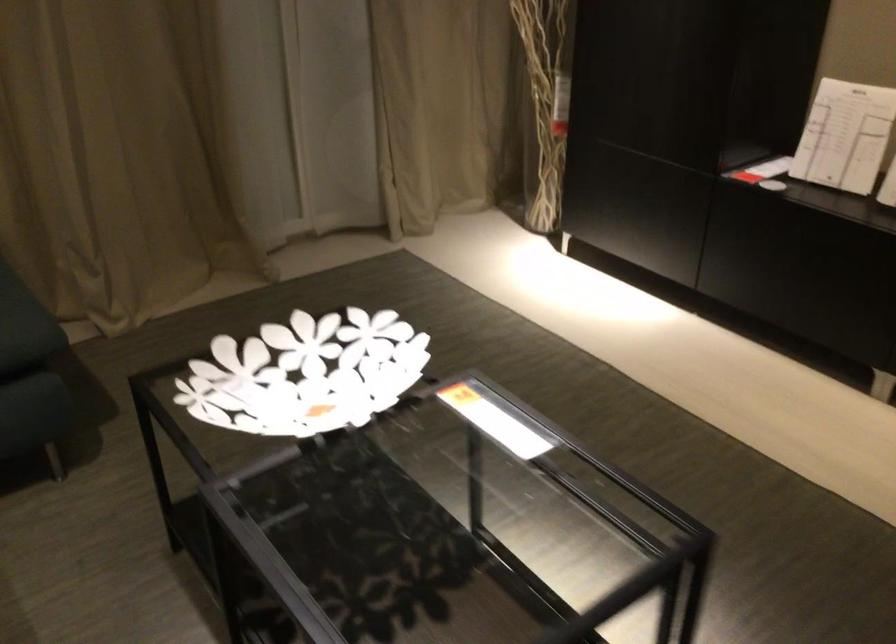
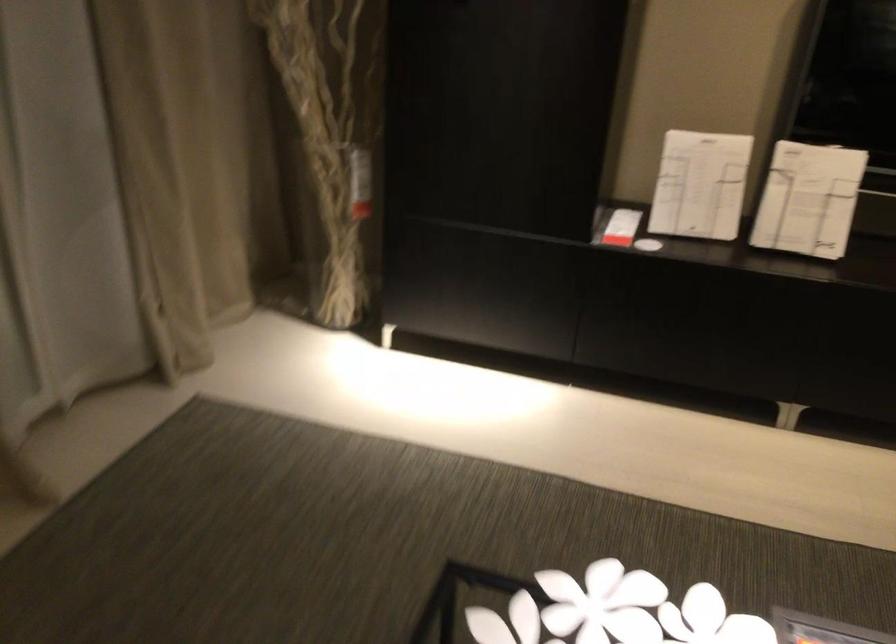
Where in the second image is the point corresponding to pixel 561 99 from the first image?

(359, 182)